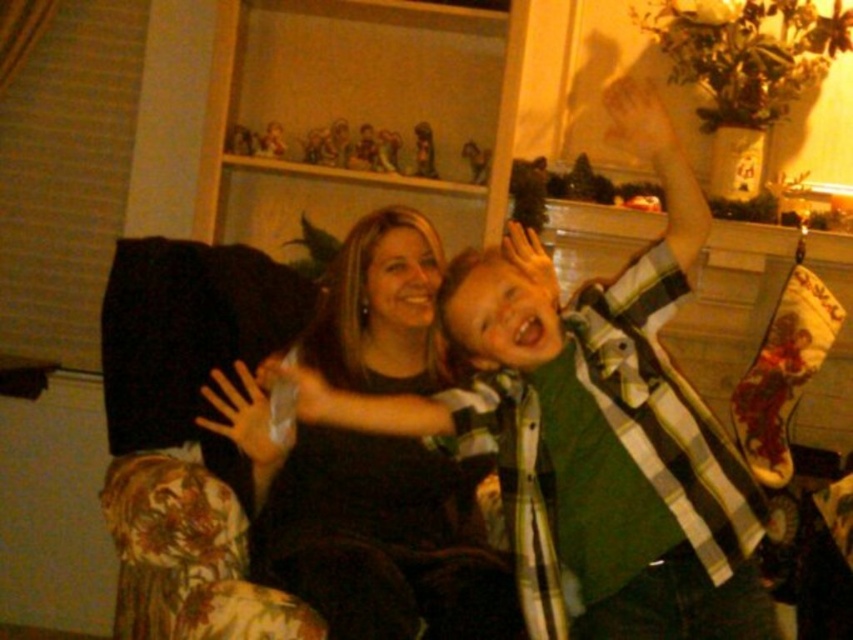
Question: Does green plaid shirt at center have a smaller size compared to black matte shirt at center?

Choices:
 (A) no
 (B) yes

Answer: (A)

Question: Which point is closer to the camera taking this photo?

Choices:
 (A) (337, 628)
 (B) (721, 554)

Answer: (B)

Question: From the image, what is the correct spatial relationship of green plaid shirt at center in relation to black matte shirt at center?

Choices:
 (A) above
 (B) below

Answer: (A)

Question: Does green plaid shirt at center appear on the left side of black matte shirt at center?

Choices:
 (A) no
 (B) yes

Answer: (A)

Question: Which point appears closest to the camera in this image?

Choices:
 (A) (344, 483)
 (B) (505, 328)

Answer: (B)